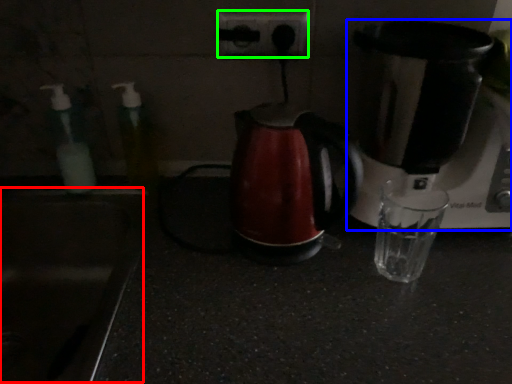
Question: Which is nearer to the sink (highlighted by a red box)? coffee maker (highlighted by a blue box) or power plugs and sockets (highlighted by a green box).

Choices:
 (A) coffee maker
 (B) power plugs and sockets

Answer: (B)